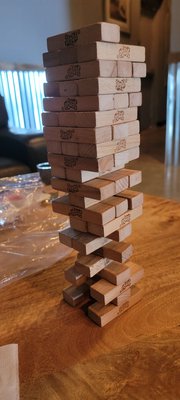
Identify the location of door. Image resolution: width=180 pixels, height=400 pixels. (151, 105).